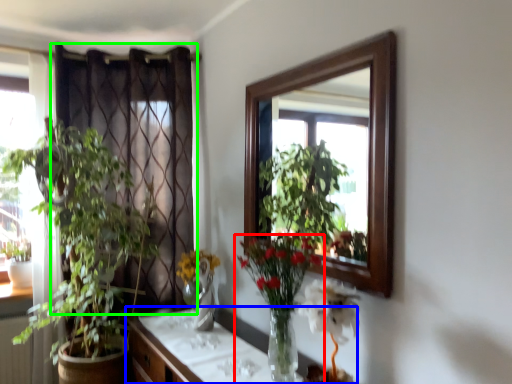
Question: Considering the real-world distances, which object is closest to houseplant (highlighted by a red box)? cabinetry (highlighted by a blue box) or curtain (highlighted by a green box).

Choices:
 (A) cabinetry
 (B) curtain

Answer: (A)